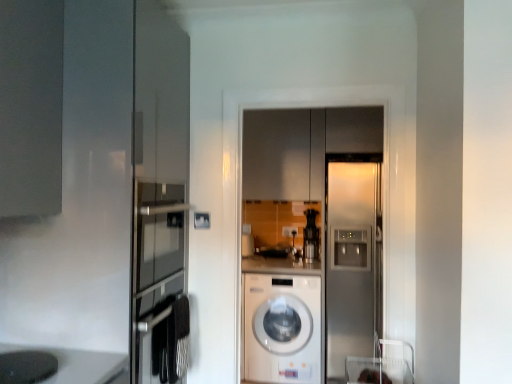
Where is `white plastic electric outlet at center`? This screenshot has height=384, width=512. white plastic electric outlet at center is located at coordinates (289, 231).

What do you see at coordinates (27, 367) in the screenshot?
I see `matte black coffee maker at lower left` at bounding box center [27, 367].

Measure the distance between point (317, 115) and camera.

The depth of point (317, 115) is 3.38 meters.

Describe the element at coordinates (283, 154) in the screenshot. This screenshot has height=384, width=512. I see `matte gray cabinet at center` at that location.

Describe the element at coordinates (282, 328) in the screenshot. The image size is (512, 384). I see `white glossy washing machine at center` at that location.

Image resolution: width=512 pixels, height=384 pixels. Identify the location of satin silver refrigerator at center. (352, 258).

Visually, is white plastic electric outlet at center positioned to the left or to the right of matte black coffee maker at lower left?

From the image, it's evident that white plastic electric outlet at center is to the right of matte black coffee maker at lower left.

Between point (292, 233) and point (37, 365), which one is positioned in front?

The point (37, 365) is in front.

Do you think white plastic electric outlet at center is within matte black coffee maker at lower left, or outside of it?

white plastic electric outlet at center is located beyond the bounds of matte black coffee maker at lower left.

Which of these two, white plastic electric outlet at center or matte black coffee maker at lower left, is smaller?

Smaller between the two is white plastic electric outlet at center.

Consider the image. Considering the sizes of objects satin silver refrigerator at center and matte black coffee maker at lower left in the image provided, who is thinner, satin silver refrigerator at center or matte black coffee maker at lower left?

matte black coffee maker at lower left is thinner.

Is point (337, 373) farther from viewer compared to point (45, 376)?

Yes, it is.

Between satin silver refrigerator at center and matte black coffee maker at lower left, which one appears on the right side from the viewer's perspective?

satin silver refrigerator at center.

Is satin silver refrigerator at center bigger than matte black coffee maker at lower left?

Correct, satin silver refrigerator at center is larger in size than matte black coffee maker at lower left.

In the scene shown: Measure the distance between white plastic electric outlet at center and black plastic coffee machine at center.

white plastic electric outlet at center is 18.17 inches away from black plastic coffee machine at center.

Considering the positions of objects white plastic electric outlet at center and black plastic coffee machine at center in the image provided, who is more to the left, white plastic electric outlet at center or black plastic coffee machine at center?

Positioned to the left is white plastic electric outlet at center.

Is white plastic electric outlet at center facing away from black plastic coffee machine at center?

No, white plastic electric outlet at center is not facing away from black plastic coffee machine at center.

Consider the image. From a real-world perspective, which is physically above, white plastic electric outlet at center or black plastic coffee machine at center?

From a 3D spatial view, black plastic coffee machine at center is above.

In terms of size, does matte black coffee maker at lower left appear bigger or smaller than matte gray cabinet at center?

matte black coffee maker at lower left is smaller than matte gray cabinet at center.

Is matte black coffee maker at lower left closer to the viewer compared to matte gray cabinet at center?

Yes, matte black coffee maker at lower left is closer to the viewer.

Is matte black coffee maker at lower left oriented towards matte gray cabinet at center?

No, matte black coffee maker at lower left is not facing towards matte gray cabinet at center.

Is matte black coffee maker at lower left far away from matte gray cabinet at center?

Yes, matte black coffee maker at lower left and matte gray cabinet at center are quite far apart.

Is matte gray cabinet at center aimed at satin silver refrigerator at center?

No, matte gray cabinet at center is not facing towards satin silver refrigerator at center.

Is matte gray cabinet at center far away from satin silver refrigerator at center?

They are positioned close to each other.

From the image's perspective, is matte gray cabinet at center under satin silver refrigerator at center?

No, from the image's perspective, matte gray cabinet at center is not beneath satin silver refrigerator at center.

Locate an element on the screen. Image resolution: width=512 pixels, height=384 pixels. screen door in front of the matte gray cabinet at center is located at coordinates point(352,258).

Which is more to the right, white plastic electric outlet at center or satin silver refrigerator at center?

Positioned to the right is satin silver refrigerator at center.

From a real-world perspective, is white plastic electric outlet at center located beneath satin silver refrigerator at center?

No, from a real-world perspective, white plastic electric outlet at center is not below satin silver refrigerator at center.

In the scene shown: Can you confirm if white plastic electric outlet at center is smaller than satin silver refrigerator at center?

Yes.

Is satin silver refrigerator at center located within white plastic electric outlet at center?

No.

Considering the relative sizes of white plastic electric outlet at center and matte gray cabinet at center in the image provided, is white plastic electric outlet at center bigger than matte gray cabinet at center?

Incorrect, white plastic electric outlet at center is not larger than matte gray cabinet at center.

Which object is thinner, white plastic electric outlet at center or matte gray cabinet at center?

white plastic electric outlet at center is thinner.

In the image, is white plastic electric outlet at center positioned in front of or behind matte gray cabinet at center?

In the image, white plastic electric outlet at center appears behind matte gray cabinet at center.

Is white plastic electric outlet at center facing towards matte gray cabinet at center?

No, white plastic electric outlet at center is not aimed at matte gray cabinet at center.

The image size is (512, 384). Identify the location of electric outlet behind the matte black coffee maker at lower left. [x=289, y=231].

Find the location of `appliance positioned vertically above the satin silver refrigerator at center (from a real-world perspective)`. appliance positioned vertically above the satin silver refrigerator at center (from a real-world perspective) is located at coordinates (27, 367).

Based on their spatial positions, is satin silver refrigerator at center or black plastic coffee machine at center further from white glossy washing machine at center?

black plastic coffee machine at center lies further to white glossy washing machine at center than the other object.

Based on their spatial positions, is white plastic electric outlet at center or matte black coffee maker at lower left closer to white glossy washing machine at center?

white plastic electric outlet at center.

Based on the photo, looking at the image, which one is located closer to white glossy washing machine at center, black plastic coffee machine at center or satin silver refrigerator at center?

satin silver refrigerator at center lies closer to white glossy washing machine at center than the other object.

When comparing their distances from white glossy washing machine at center, does white plastic electric outlet at center or satin silver refrigerator at center seem further?

The object further to white glossy washing machine at center is white plastic electric outlet at center.

Based on their spatial positions, is black plastic coffee machine at center or satin silver refrigerator at center closer to matte gray cabinet at center?

black plastic coffee machine at center is positioned closer to the anchor matte gray cabinet at center.

When comparing their distances from matte gray cabinet at center, does satin silver refrigerator at center or white glossy washing machine at center seem further?

Among the two, white glossy washing machine at center is located further to matte gray cabinet at center.

Looking at this image, estimate the real-world distances between objects in this image. Which object is closer to white glossy washing machine at center, matte black coffee maker at lower left or matte gray cabinet at center?

matte gray cabinet at center lies closer to white glossy washing machine at center than the other object.

Looking at the image, which one is located further to satin silver refrigerator at center, white plastic electric outlet at center or matte gray cabinet at center?

white plastic electric outlet at center is positioned further to the anchor satin silver refrigerator at center.

Where is `coffee machine that lies between matte gray cabinet at center and white glossy washing machine at center from top to bottom`? Image resolution: width=512 pixels, height=384 pixels. coffee machine that lies between matte gray cabinet at center and white glossy washing machine at center from top to bottom is located at coordinates (311, 236).

You are a GUI agent. You are given a task and a screenshot of the screen. Output one action in this format:
    pyautogui.click(x=<x>, y=<y>)
    Task: Click on the washing machine located between matte black coffee maker at lower left and matte gray cabinet at center in the depth direction
    The height and width of the screenshot is (384, 512).
    Given the screenshot: What is the action you would take?
    pyautogui.click(x=282, y=328)

I want to click on washing machine located between matte black coffee maker at lower left and white plastic electric outlet at center in the depth direction, so click(x=282, y=328).

Where is `coffee machine between matte gray cabinet at center and white plastic electric outlet at center in the up-down direction`? This screenshot has height=384, width=512. coffee machine between matte gray cabinet at center and white plastic electric outlet at center in the up-down direction is located at coordinates (311, 236).